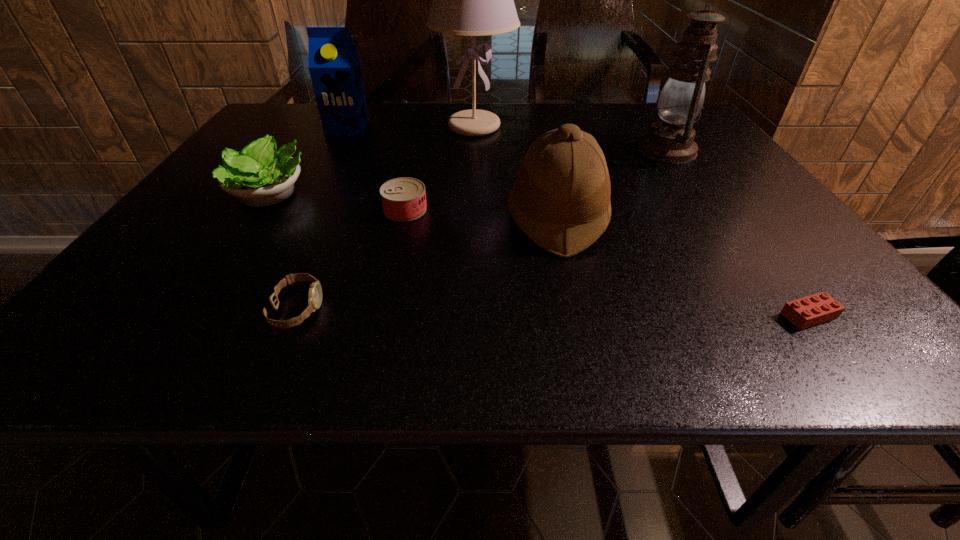
Where is `vacant space that's between the oil lamp and the hat`? vacant space that's between the oil lamp and the hat is located at coordinates (612, 185).

Image resolution: width=960 pixels, height=540 pixels. Identify the location of unoccupied position between the carton and the fourth shortest object. (308, 161).

Find the location of a particular element. Image resolution: width=960 pixels, height=540 pixels. vacant space that's between the fourth tallest object and the watch is located at coordinates (427, 264).

The height and width of the screenshot is (540, 960). I want to click on vacant space that's between the oil lamp and the watch, so click(x=482, y=230).

The image size is (960, 540). Identify the location of free spot between the hat and the Lego. (683, 267).

The width and height of the screenshot is (960, 540). Identify the location of free spot between the watch and the oil lamp. (482, 230).

The width and height of the screenshot is (960, 540). In order to click on free area in between the carton and the can in this screenshot , I will do `click(376, 168)`.

The height and width of the screenshot is (540, 960). Identify the location of vacant area between the Lego and the seventh shortest object. (737, 233).

Identify which object is the seventh closest to the fifth shortest object. Please provide its 2D coordinates. Your answer should be formatted as a tuple, i.e. [(x, y)], where the tuple contains the x and y coordinates of a point satisfying the conditions above.

[(333, 62)]

Identify which object is the second nearest to the shortest object. Please provide its 2D coordinates. Your answer should be formatted as a tuple, i.e. [(x, y)], where the tuple contains the x and y coordinates of a point satisfying the conditions above.

[(671, 141)]